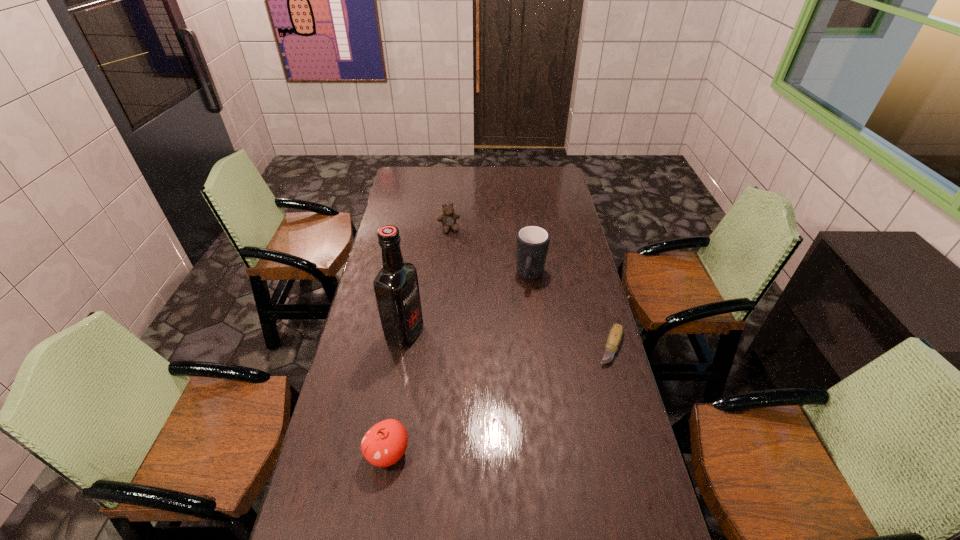
Where is `vacant space located 0.060m on the side of the second farthest object with the handle`? The height and width of the screenshot is (540, 960). vacant space located 0.060m on the side of the second farthest object with the handle is located at coordinates (526, 303).

The width and height of the screenshot is (960, 540). I want to click on free spot located 0.280m on the side of the second farthest object with the handle, so click(x=516, y=347).

You are a GUI agent. You are given a task and a screenshot of the screen. Output one action in this format:
    pyautogui.click(x=<x>, y=<y>)
    Task: Click on the vacant space located on the side of the second farthest object with the handle
    Image resolution: width=960 pixels, height=540 pixels.
    Given the screenshot: What is the action you would take?
    pyautogui.click(x=525, y=308)

Locate an element on the screen. Image resolution: width=960 pixels, height=540 pixels. blank space located 0.270m on the face of the teddy bear is located at coordinates tap(467, 272).

The width and height of the screenshot is (960, 540). Identify the location of free space located 0.270m on the face of the teddy bear. (467, 272).

Where is `vacant position located on the face of the teddy bear`? vacant position located on the face of the teddy bear is located at coordinates (474, 292).

At what (x,y) coordinates should I click in order to perform the action: click on vacant space located on the front-facing side of the tallest object. Please return your answer as a coordinate pair (x, y). Image resolution: width=960 pixels, height=540 pixels. Looking at the image, I should click on (449, 349).

Locate an element on the screen. Image resolution: width=960 pixels, height=540 pixels. vacant area situated 0.290m on the front-facing side of the tallest object is located at coordinates pyautogui.click(x=498, y=366).

At what (x,y) coordinates should I click in order to perform the action: click on vacant space situated 0.130m on the front-facing side of the tallest object. Please return your answer as a coordinate pair (x, y). This screenshot has height=540, width=960. Looking at the image, I should click on (455, 350).

Identify the location of apple present at the left edge. (385, 443).